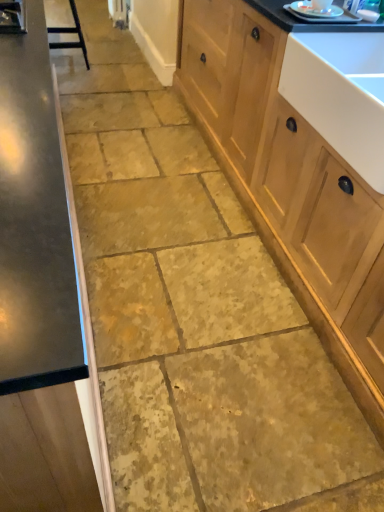
Question: Considering the positions of wooden cabinet at right, placed as the first cabinetry when sorted from right to left, and black metal bar stool at upper left in the image, is wooden cabinet at right, placed as the first cabinetry when sorted from right to left, wider or thinner than black metal bar stool at upper left?

Choices:
 (A) thin
 (B) wide

Answer: (B)

Question: From a real-world perspective, is wooden cabinet at right, which appears as the second cabinetry when viewed from the left, positioned above or below black metal bar stool at upper left?

Choices:
 (A) above
 (B) below

Answer: (A)

Question: Considering the real-world distances, which object is farthest from the white glossy sink at upper right?

Choices:
 (A) metallic silver plate at upper right
 (B) black metal bar stool at upper left
 (C) wooden cabinet at right, which appears as the second cabinetry when viewed from the left
 (D) satin wood cabinet at left, the 1th cabinetry in the left-to-right sequence

Answer: (B)

Question: Estimate the real-world distances between objects in this image. Which object is farther from the satin wood cabinet at left, the 1th cabinetry in the left-to-right sequence?

Choices:
 (A) white glossy sink at upper right
 (B) wooden cabinet at right, placed as the first cabinetry when sorted from right to left
 (C) metallic silver plate at upper right
 (D) black metal bar stool at upper left

Answer: (D)